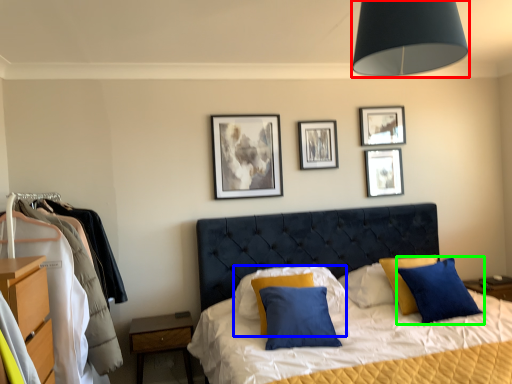
Question: Based on their relative distances, which object is nearer to light fixture (highlighted by a red box)? Choose from pillow (highlighted by a blue box) and pillow (highlighted by a green box).

Choices:
 (A) pillow
 (B) pillow

Answer: (B)